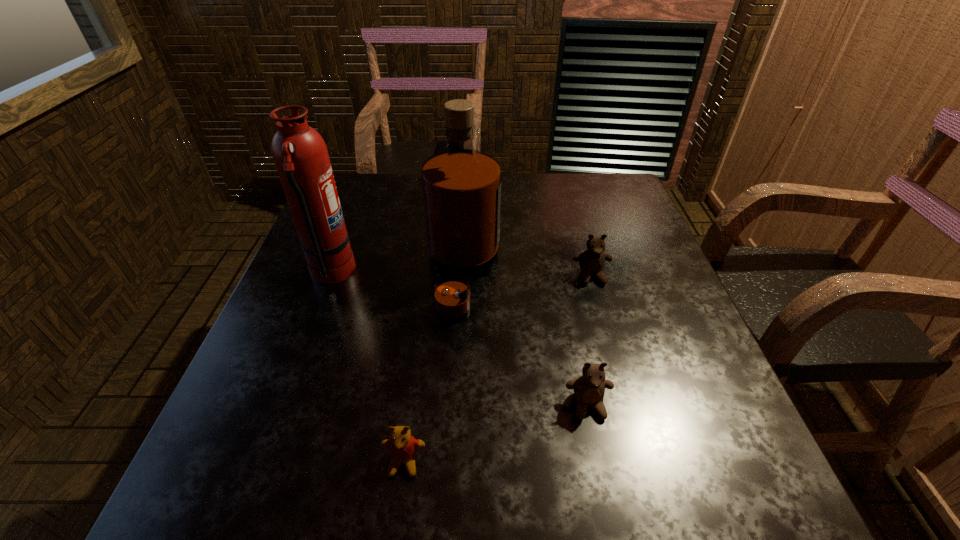
Identify the location of the leftmost object. This screenshot has width=960, height=540. (300, 154).

Locate an element on the screen. This screenshot has height=540, width=960. liquor is located at coordinates (461, 186).

Where is `the farthest teddy bear`? the farthest teddy bear is located at coordinates (592, 261).

This screenshot has width=960, height=540. Find the location of `the second nearest teddy bear`. the second nearest teddy bear is located at coordinates (589, 388).

Image resolution: width=960 pixels, height=540 pixels. I want to click on the nearest teddy bear, so click(x=402, y=446).

I want to click on the shortest teddy bear, so click(402, 446).

What are the coordinates of `free space located 0.120m on the label side of the leftmost object` in the screenshot? It's located at (404, 273).

You are a GUI agent. You are given a task and a screenshot of the screen. Output one action in this format:
    pyautogui.click(x=<x>, y=<y>)
    Task: Click on the vacant space located 0.100m on the front label of the liquor
    The image size is (960, 540).
    Given the screenshot: What is the action you would take?
    pyautogui.click(x=541, y=275)

Where is `free spot located at the face of the farthest teddy bear`? free spot located at the face of the farthest teddy bear is located at coordinates (607, 333).

Find the location of `free spot located 0.130m on the front-facing side of the second nearest teddy bear`. free spot located 0.130m on the front-facing side of the second nearest teddy bear is located at coordinates (608, 500).